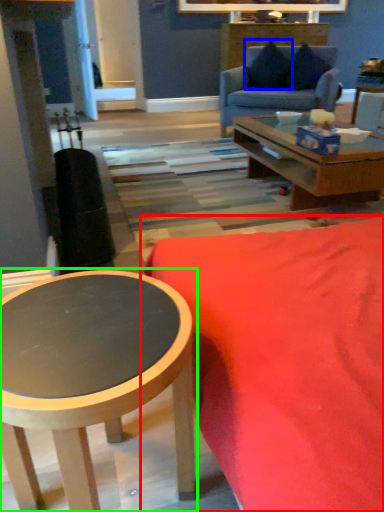
Question: Which is nearer to the studio couch (highlighted by a red box)? pillow (highlighted by a blue box) or coffee table (highlighted by a green box).

Choices:
 (A) pillow
 (B) coffee table

Answer: (B)